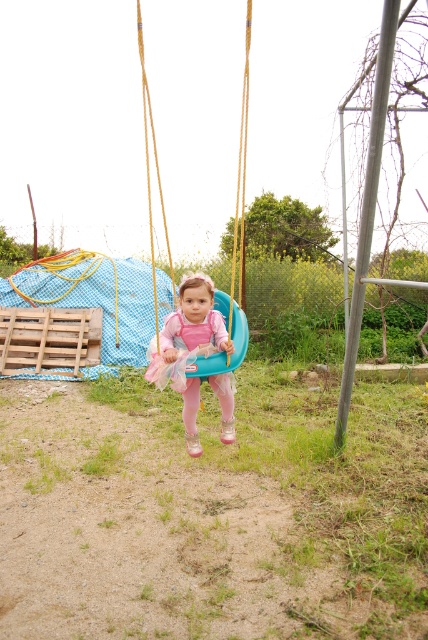
You are a photographer setting up for a photoshoot in the backyard. You need to position a pink tulle dress at center and a teal plastic swing at center in a way that they are both visible in the frame. Considering their sizes, which object should you place closer to the camera to ensure both are fully visible?

The pink tulle dress at center occupies less space than the teal plastic swing at center. To ensure both are fully visible in the frame, you should place the teal plastic swing at center closer to the camera since it is larger and requires more space in the composition.

Consider the image. You are a photographer trying to capture a photo of the child in the pink tulle dress at center and the teal plastic swing at center. Based on their heights, which object should you focus on first if you want to ensure both are in frame without adjusting your camera angle?

The pink tulle dress at center is shorter than the teal plastic swing at center, so you should focus on the taller teal plastic swing at center first to ensure both are in frame.